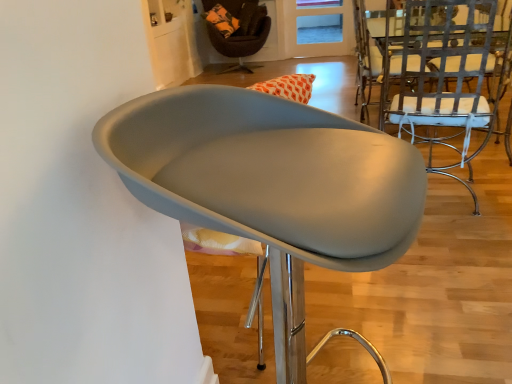
Question: Does velvet brown armchair at upper center, marked as the 3th chair in a bottom-to-top arrangement, have a lesser width compared to matte gray chair at center, which is the 2th chair in left-to-right order?

Choices:
 (A) yes
 (B) no

Answer: (B)

Question: Could you tell me if velvet brown armchair at upper center, positioned as the 1th chair in top-to-bottom order, is turned towards matte gray chair at center, the second chair viewed from the right?

Choices:
 (A) yes
 (B) no

Answer: (A)

Question: Does velvet brown armchair at upper center, marked as the 3th chair in a right-to-left arrangement, lie behind matte gray chair at center, which is the 2th chair in left-to-right order?

Choices:
 (A) no
 (B) yes

Answer: (B)

Question: Is the position of velvet brown armchair at upper center, placed as the first chair when sorted from back to front, less distant than that of matte gray chair at center, marked as the first chair in a bottom-to-top arrangement?

Choices:
 (A) yes
 (B) no

Answer: (B)

Question: Is velvet brown armchair at upper center, positioned as the 1th chair in top-to-bottom order, bigger than matte gray chair at center, marked as the first chair in a bottom-to-top arrangement?

Choices:
 (A) no
 (B) yes

Answer: (B)

Question: Would you say metallic silver chair at right, which is counted as the 3th chair, starting from the left, is to the left or to the right of translucent orange glass door at upper center in the picture?

Choices:
 (A) right
 (B) left

Answer: (B)

Question: Is metallic silver chair at right, which is counted as the 1th chair, starting from the right, bigger or smaller than translucent orange glass door at upper center?

Choices:
 (A) big
 (B) small

Answer: (A)

Question: Is metallic silver chair at right, which is counted as the 3th chair, starting from the left, taller or shorter than translucent orange glass door at upper center?

Choices:
 (A) tall
 (B) short

Answer: (A)

Question: Is metallic silver chair at right, which is counted as the 3th chair, starting from the left, wider or thinner than translucent orange glass door at upper center?

Choices:
 (A) wide
 (B) thin

Answer: (A)

Question: Looking at their shapes, would you say matte gray chair at center, positioned as the third chair in top-to-bottom order, is wider or thinner than translucent orange glass door at upper center?

Choices:
 (A) thin
 (B) wide

Answer: (B)

Question: In the image, is matte gray chair at center, marked as the first chair in a bottom-to-top arrangement, positioned in front of or behind translucent orange glass door at upper center?

Choices:
 (A) front
 (B) behind

Answer: (A)

Question: Is point (303, 322) positioned closer to the camera than point (353, 36)?

Choices:
 (A) farther
 (B) closer

Answer: (B)

Question: Would you say matte gray chair at center, marked as the first chair in a bottom-to-top arrangement, is to the left or to the right of translucent orange glass door at upper center in the picture?

Choices:
 (A) right
 (B) left

Answer: (B)

Question: Considering the positions of matte gray chair at center, positioned as the third chair in top-to-bottom order, and velvet brown armchair at upper center, positioned as the 1th chair in top-to-bottom order, in the image, is matte gray chair at center, positioned as the third chair in top-to-bottom order, taller or shorter than velvet brown armchair at upper center, positioned as the 1th chair in top-to-bottom order,?

Choices:
 (A) tall
 (B) short

Answer: (A)

Question: Considering the positions of matte gray chair at center, marked as the first chair in a bottom-to-top arrangement, and velvet brown armchair at upper center, placed as the first chair when sorted from back to front, in the image, is matte gray chair at center, marked as the first chair in a bottom-to-top arrangement, bigger or smaller than velvet brown armchair at upper center, placed as the first chair when sorted from back to front,?

Choices:
 (A) big
 (B) small

Answer: (B)